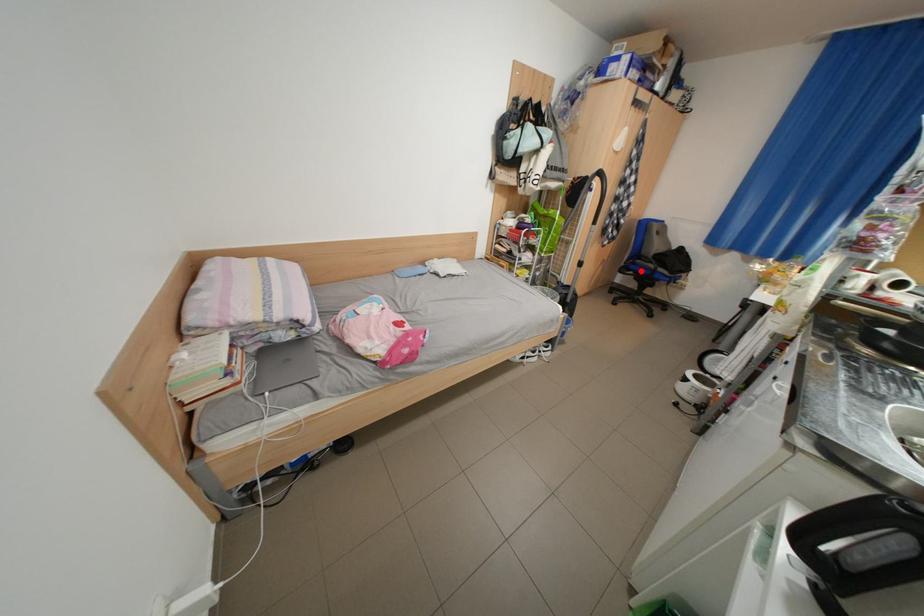
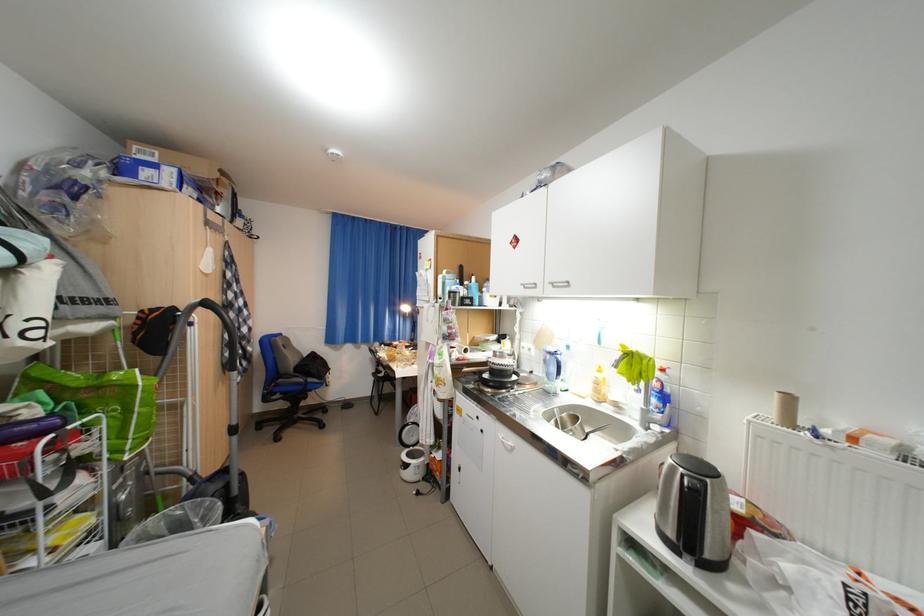
Question: A red point is marked in image1. In image2, is the corresponding 3D point closer to the camera or farther? Reply with the corresponding letter.

Choices:
 (A) The corresponding 3D point is closer.
 (B) The corresponding 3D point is farther.

Answer: (B)